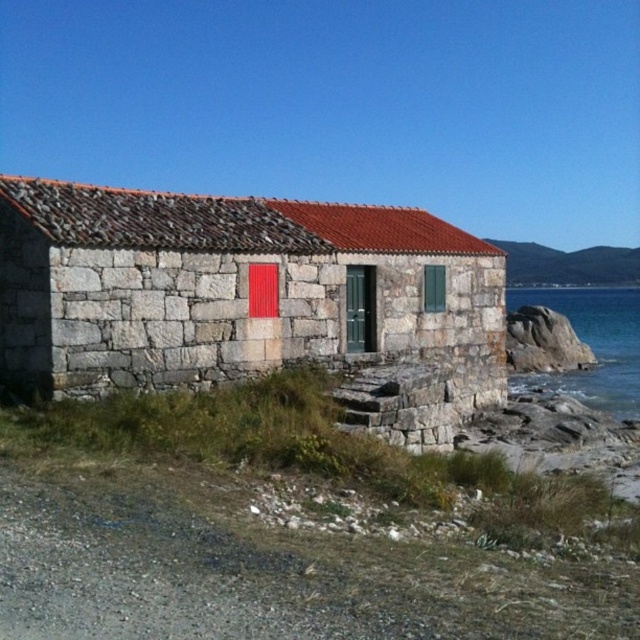
The height and width of the screenshot is (640, 640). Identify the location of stone textured hut at center. (250, 300).

Is the position of stone textured hut at center more distant than that of blue water at lower right?

That is False.

Between point (348, 324) and point (604, 324), which one is positioned behind?

The point (604, 324) is behind.

The width and height of the screenshot is (640, 640). Identify the location of stone textured hut at center. (250, 300).